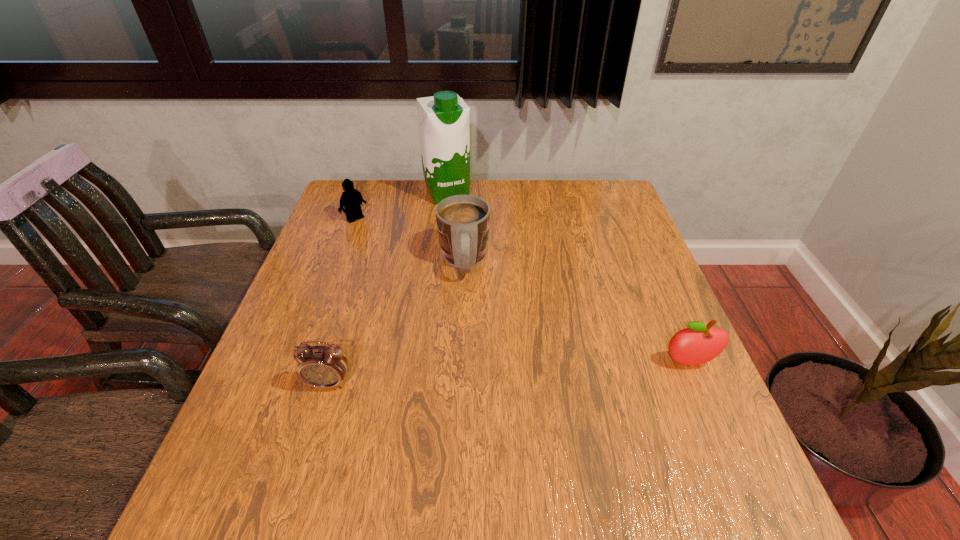
The width and height of the screenshot is (960, 540). What are the coordinates of `the closest object to the rightmost object` in the screenshot? It's located at (463, 221).

You are a GUI agent. You are given a task and a screenshot of the screen. Output one action in this format:
    pyautogui.click(x=<x>, y=<y>)
    Task: Click on the object that can be found as the second closest to the third farthest object
    The width and height of the screenshot is (960, 540).
    Given the screenshot: What is the action you would take?
    pyautogui.click(x=351, y=199)

I want to click on free location that satisfies the following two spatial constraints: 1. on the front side of the soya milk; 2. on the right side of the mug, so click(441, 262).